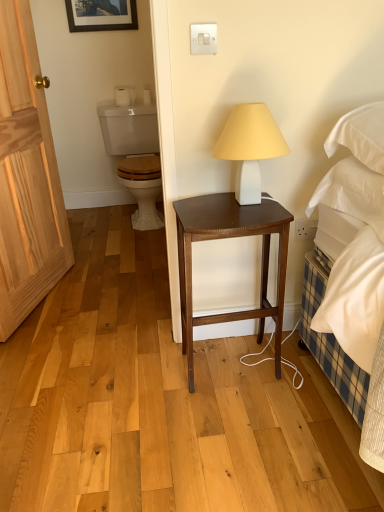
Question: Is dark wood stool at center placed right next to white matte toilet paper at upper left?

Choices:
 (A) no
 (B) yes

Answer: (A)

Question: Is dark wood stool at center bigger than white matte toilet paper at upper left?

Choices:
 (A) no
 (B) yes

Answer: (B)

Question: Can we say dark wood stool at center lies outside white matte toilet paper at upper left?

Choices:
 (A) no
 (B) yes

Answer: (B)

Question: Is dark wood stool at center facing towards white matte toilet paper at upper left?

Choices:
 (A) no
 (B) yes

Answer: (A)

Question: From a real-world perspective, does dark wood stool at center sit lower than white matte toilet paper at upper left?

Choices:
 (A) yes
 (B) no

Answer: (A)

Question: Does dark wood stool at center have a greater width compared to white matte toilet paper at upper left?

Choices:
 (A) yes
 (B) no

Answer: (A)

Question: Is dark wood stool at center oriented away from white matte lamp at center?

Choices:
 (A) no
 (B) yes

Answer: (A)

Question: Does dark wood stool at center appear on the right side of white matte lamp at center?

Choices:
 (A) no
 (B) yes

Answer: (A)

Question: Is dark wood stool at center shorter than white matte lamp at center?

Choices:
 (A) yes
 (B) no

Answer: (B)

Question: Can you confirm if dark wood stool at center is thinner than white matte lamp at center?

Choices:
 (A) yes
 (B) no

Answer: (B)

Question: From a real-world perspective, is dark wood stool at center under white matte lamp at center?

Choices:
 (A) yes
 (B) no

Answer: (A)

Question: From a real-world perspective, is dark wood stool at center over white matte lamp at center?

Choices:
 (A) yes
 (B) no

Answer: (B)

Question: Can you confirm if white matte toilet paper at upper left is bigger than white matte lamp at center?

Choices:
 (A) yes
 (B) no

Answer: (B)